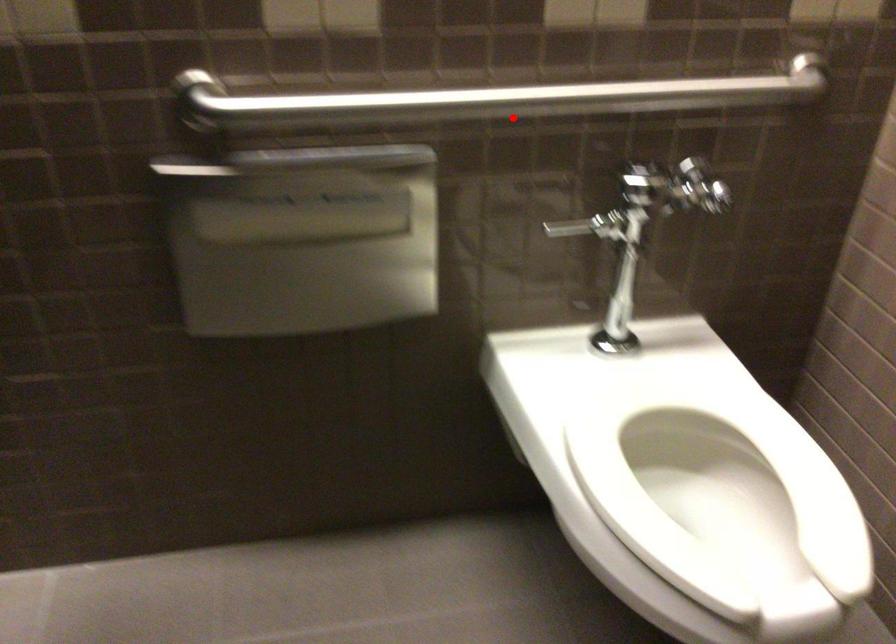
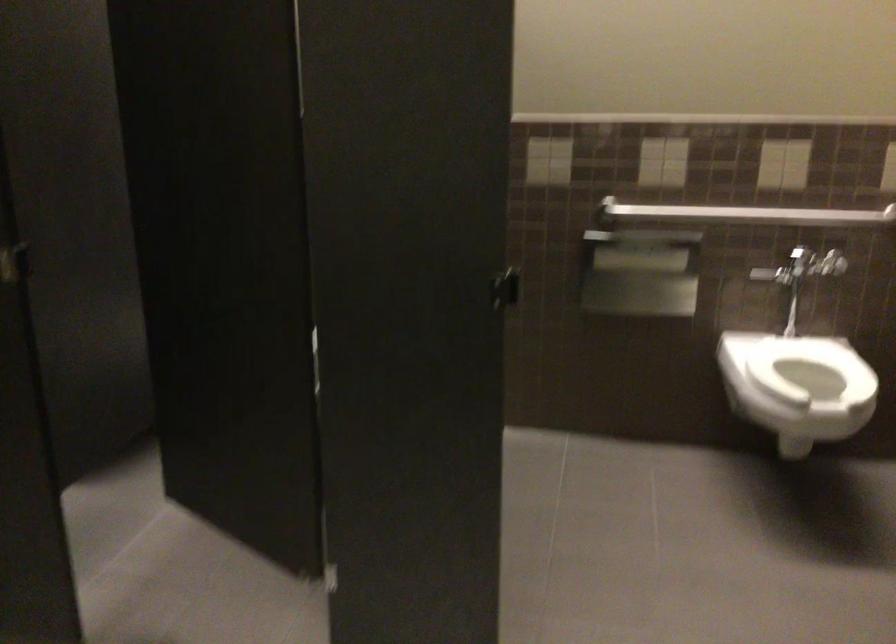
Question: I am providing you with two images of the same scene from different viewpoints. A red point is shown in image1. For the corresponding object point in image2, is it positioned nearer or farther from the camera?

Choices:
 (A) Nearer
 (B) Farther

Answer: (B)